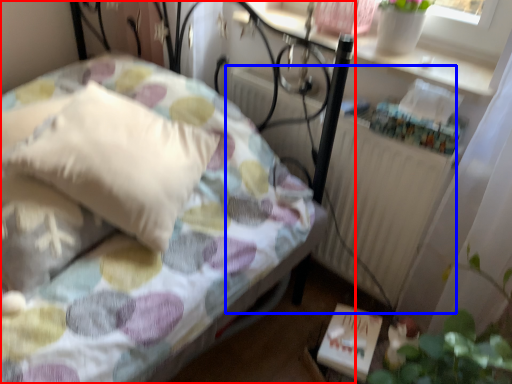
Question: Among these objects, which one is farthest to the camera, bed (highlighted by a red box) or radiator (highlighted by a blue box)?

Choices:
 (A) bed
 (B) radiator

Answer: (B)